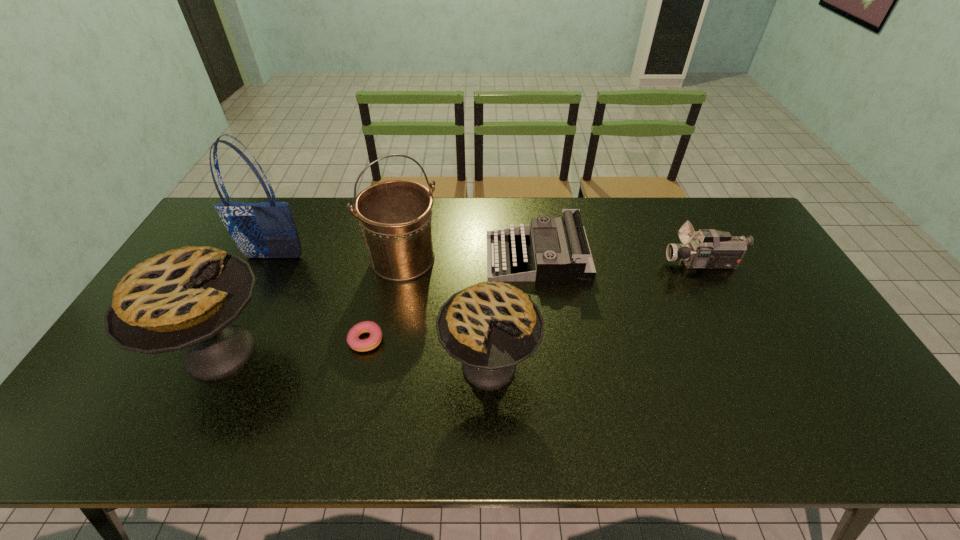
The image size is (960, 540). In order to click on free space between the fourth tallest object and the rightmost object in this screenshot , I will do `click(596, 315)`.

Locate an element on the screen. vacant area between the fourth tallest object and the shortest object is located at coordinates (427, 353).

You are a GUI agent. You are given a task and a screenshot of the screen. Output one action in this format:
    pyautogui.click(x=<x>, y=<y>)
    Task: Click on the free space between the fifth tallest object and the typewriter
    
    Given the screenshot: What is the action you would take?
    pyautogui.click(x=620, y=260)

The width and height of the screenshot is (960, 540). Identify the location of vacant area that lies between the bucket and the shortest object. (385, 300).

Where is `free space that is in between the shortest object and the left pie`? This screenshot has height=540, width=960. free space that is in between the shortest object and the left pie is located at coordinates (294, 346).

Locate an element on the screen. The image size is (960, 540). empty space that is in between the doughnut and the right pie is located at coordinates (427, 353).

Locate which object is the second closest to the rightmost object. Please provide its 2D coordinates. Your answer should be formatted as a tuple, i.e. [(x, y)], where the tuple contains the x and y coordinates of a point satisfying the conditions above.

[(490, 327)]

Choose which object is the fourth nearest neighbor to the shopping bag. Please provide its 2D coordinates. Your answer should be formatted as a tuple, i.e. [(x, y)], where the tuple contains the x and y coordinates of a point satisfying the conditions above.

[(490, 327)]

This screenshot has height=540, width=960. Find the location of `free space that satisfies the following two spatial constraints: 1. on the front-facing side of the shopping bag; 2. on the left side of the bucket`. free space that satisfies the following two spatial constraints: 1. on the front-facing side of the shopping bag; 2. on the left side of the bucket is located at coordinates (274, 260).